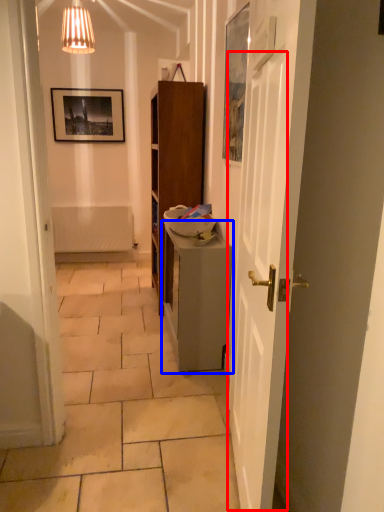
Question: Which object is further to the camera taking this photo, door (highlighted by a red box) or table (highlighted by a blue box)?

Choices:
 (A) door
 (B) table

Answer: (B)